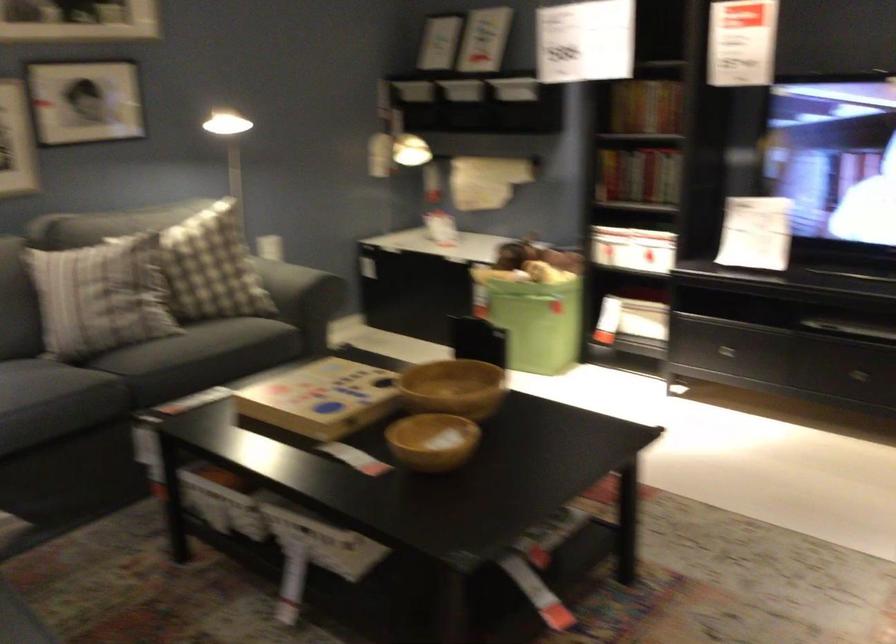
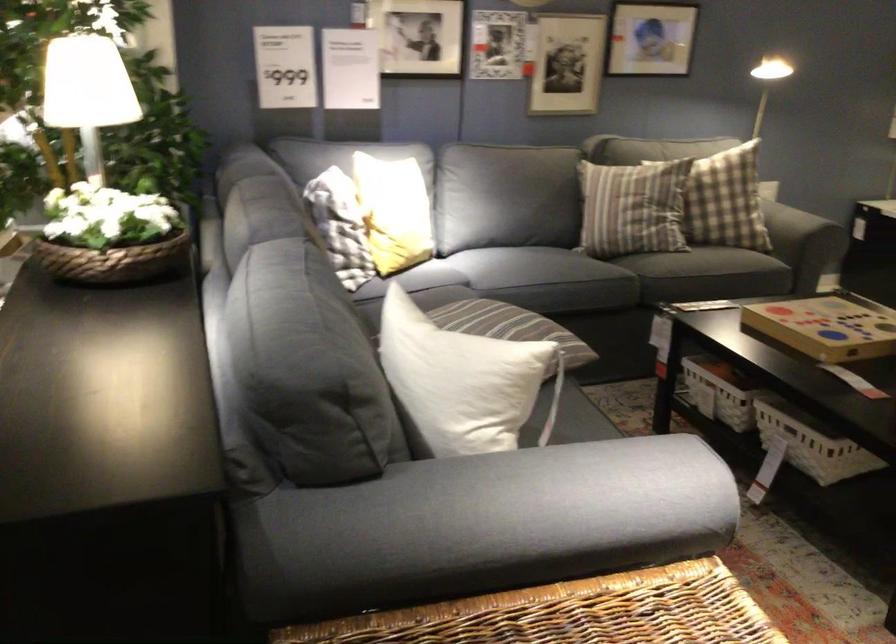
The point at (328,552) is marked in the first image. Where is the corresponding point in the second image?

(814, 448)